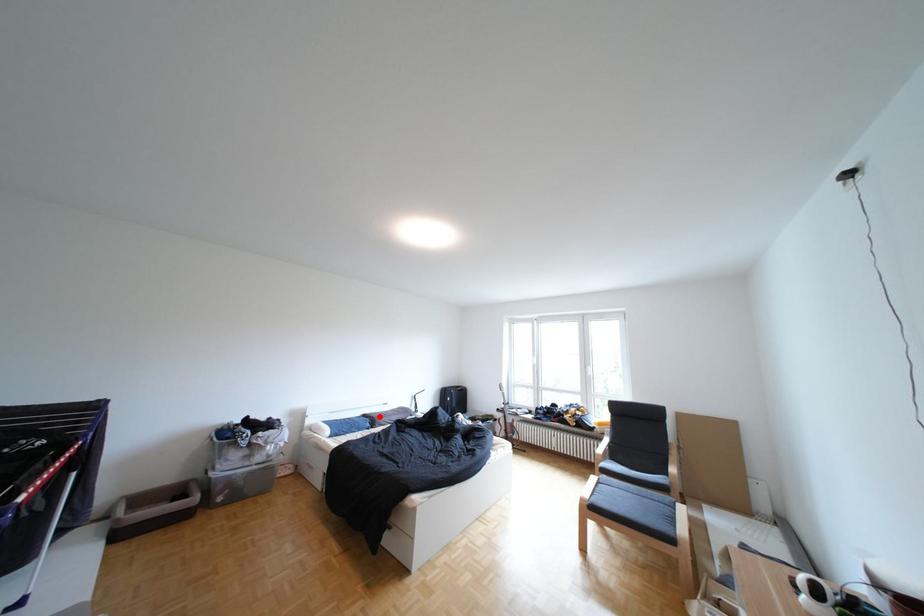
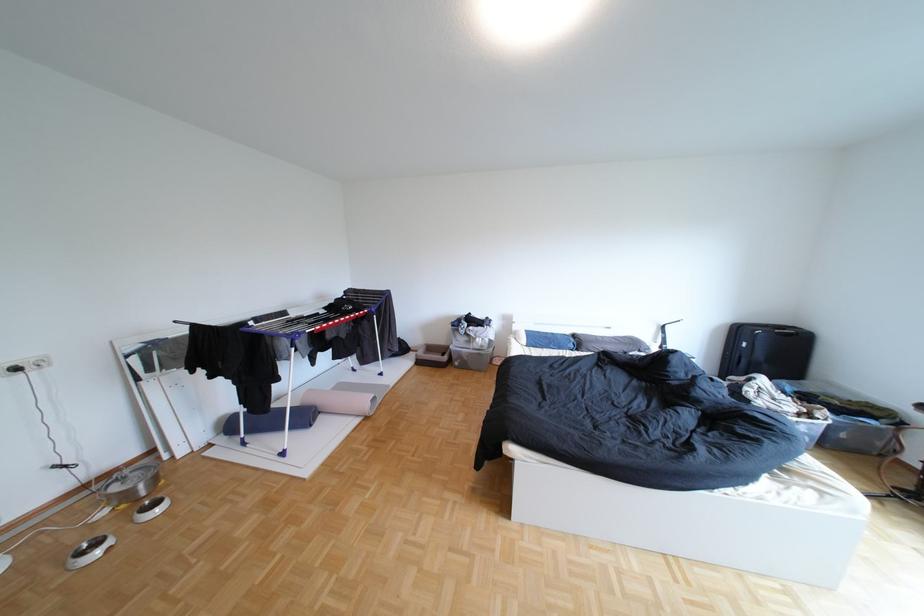
The point at the highlighted location is marked in the first image. Where is the corresponding point in the second image?

(590, 336)